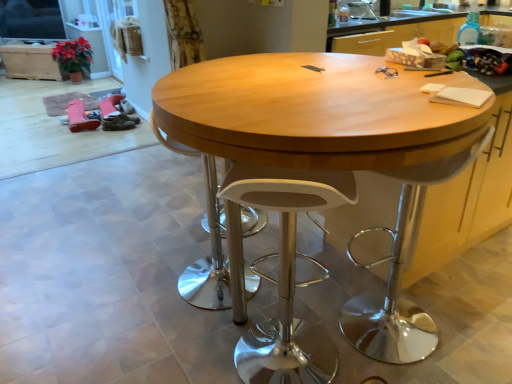
In order to face white plastic swivel chair at right, the first swivel chair in the right-to-left sequence, should I rotate leftwards or rightwards?

To align with it, rotate right about 19.222°.

Image resolution: width=512 pixels, height=384 pixels. Describe the element at coordinates (211, 240) in the screenshot. I see `white plastic swivel chair at center, the first swivel chair when ordered from left to right` at that location.

Measure the distance between point (323, 173) and camera.

Point (323, 173) and camera are 3.56 feet apart.

Identify the location of white plastic swivel chair at right, which is counted as the 2th swivel chair, starting from the left. (401, 272).

From a real-world perspective, who is located lower, white plastic swivel chair at center, the first swivel chair when ordered from left to right, or white plastic swivel chair at right, which is counted as the 2th swivel chair, starting from the left?

From a 3D spatial view, white plastic swivel chair at center, the first swivel chair when ordered from left to right, is below.

How different are the orientations of white plastic swivel chair at center, the first swivel chair when ordered from left to right, and white plastic swivel chair at right, which is counted as the 2th swivel chair, starting from the left, in degrees?

138 degrees separate the facing orientations of white plastic swivel chair at center, the first swivel chair when ordered from left to right, and white plastic swivel chair at right, which is counted as the 2th swivel chair, starting from the left.

Is white plastic swivel chair at center, the second swivel chair viewed from the right, inside the boundaries of white plastic swivel chair at right, the first swivel chair in the right-to-left sequence, or outside?

white plastic swivel chair at center, the second swivel chair viewed from the right, lies outside white plastic swivel chair at right, the first swivel chair in the right-to-left sequence.

Does white plastic swivel chair at center, the first swivel chair when ordered from left to right, have a larger size compared to white plastic swivel chair at right, which is counted as the 2th swivel chair, starting from the left?

Yes, white plastic swivel chair at center, the first swivel chair when ordered from left to right, is bigger than white plastic swivel chair at right, which is counted as the 2th swivel chair, starting from the left.

Where is `swivel chair on the right of the white plastic stool at center`? Image resolution: width=512 pixels, height=384 pixels. swivel chair on the right of the white plastic stool at center is located at coordinates (401, 272).

Between white plastic swivel chair at right, the first swivel chair in the right-to-left sequence, and white plastic stool at center, which one has less height?

Standing shorter between the two is white plastic stool at center.

Can you confirm if white plastic swivel chair at right, which is counted as the 2th swivel chair, starting from the left, is positioned to the left of white plastic stool at center?

In fact, white plastic swivel chair at right, which is counted as the 2th swivel chair, starting from the left, is to the right of white plastic stool at center.

Considering the positions of objects wooden cabinet at upper left and wooden table at center in the image provided, who is more to the right, wooden cabinet at upper left or wooden table at center?

wooden table at center.

Would you consider wooden cabinet at upper left to be distant from wooden table at center?

Yes, wooden cabinet at upper left is far from wooden table at center.

From the image's perspective, which is below, wooden cabinet at upper left or wooden table at center?

wooden table at center, from the image's perspective.

Does wooden cabinet at upper left contain wooden table at center?

That's incorrect, wooden table at center is not inside wooden cabinet at upper left.

Which is closer to the camera, (186, 270) or (232, 176)?

Point (186, 270) is farther from the camera than point (232, 176).

Which is more to the left, white plastic swivel chair at center, the second swivel chair viewed from the right, or white plastic stool at center?

Positioned to the left is white plastic swivel chair at center, the second swivel chair viewed from the right.

Considering the sizes of white plastic swivel chair at center, the second swivel chair viewed from the right, and white plastic stool at center in the image, is white plastic swivel chair at center, the second swivel chair viewed from the right, wider or thinner than white plastic stool at center?

In the image, white plastic swivel chair at center, the second swivel chair viewed from the right, appears to be wider than white plastic stool at center.

Based on their positions, is white plastic swivel chair at right, which is counted as the 2th swivel chair, starting from the left, located to the left or right of wooden table at center?

white plastic swivel chair at right, which is counted as the 2th swivel chair, starting from the left, is positioned on wooden table at center's right side.

Can you confirm if white plastic swivel chair at right, which is counted as the 2th swivel chair, starting from the left, is thinner than wooden table at center?

Yes.

Is white plastic swivel chair at right, the first swivel chair in the right-to-left sequence, positioned with its back to wooden table at center?

Absolutely, white plastic swivel chair at right, the first swivel chair in the right-to-left sequence, is directed away from wooden table at center.

From a real-world perspective, relative to white plastic stool at center, is wooden table at center vertically above or below?

wooden table at center is situated higher than white plastic stool at center in the real world.

Is wooden table at center to the left or to the right of white plastic stool at center in the image?

wooden table at center is to the right of white plastic stool at center.

Considering the sizes of wooden table at center and white plastic stool at center in the image, is wooden table at center wider or thinner than white plastic stool at center?

Considering their sizes, wooden table at center looks broader than white plastic stool at center.

From the picture: In terms of height, does wooden table at center look taller or shorter compared to white plastic stool at center?

Considering their sizes, wooden table at center has more height than white plastic stool at center.

Where is `table in front of the white plastic stool at center`? This screenshot has width=512, height=384. table in front of the white plastic stool at center is located at coordinates (315, 112).

Is white plastic stool at center turned away from wooden table at center?

Yes, white plastic stool at center is positioned with its back facing wooden table at center.

Is white plastic stool at center far away from wooden table at center?

No.

Find the location of `swivel chair that is behind the white plastic swivel chair at right, the first swivel chair in the right-to-left sequence`. swivel chair that is behind the white plastic swivel chair at right, the first swivel chair in the right-to-left sequence is located at coordinates (211, 240).

Locate an element on the screen. stool below the white plastic swivel chair at right, the first swivel chair in the right-to-left sequence (from the image's perspective) is located at coordinates (287, 273).

Consider the image. When comparing their distances from white plastic swivel chair at center, the second swivel chair viewed from the right, does white plastic swivel chair at right, the first swivel chair in the right-to-left sequence, or white plastic stool at center seem further?

white plastic swivel chair at right, the first swivel chair in the right-to-left sequence, is positioned further to the anchor white plastic swivel chair at center, the second swivel chair viewed from the right.

Which object lies further to the anchor point wooden table at center, white plastic swivel chair at right, which is counted as the 2th swivel chair, starting from the left, or wooden cabinet at upper left?

Among the two, wooden cabinet at upper left is located further to wooden table at center.

Which object lies further to the anchor point white plastic swivel chair at right, the first swivel chair in the right-to-left sequence, wooden table at center or white plastic stool at center?

Among the two, wooden table at center is located further to white plastic swivel chair at right, the first swivel chair in the right-to-left sequence.

Looking at the image, which one is located closer to wooden table at center, wooden cabinet at upper left or white plastic swivel chair at center, the first swivel chair when ordered from left to right?

Based on the image, white plastic swivel chair at center, the first swivel chair when ordered from left to right, appears to be nearer to wooden table at center.

Estimate the real-world distances between objects in this image. Which object is further from white plastic swivel chair at right, which is counted as the 2th swivel chair, starting from the left, wooden table at center or white plastic swivel chair at center, the first swivel chair when ordered from left to right?

Based on the image, white plastic swivel chair at center, the first swivel chair when ordered from left to right, appears to be further to white plastic swivel chair at right, which is counted as the 2th swivel chair, starting from the left.

Considering their positions, is white plastic swivel chair at center, the first swivel chair when ordered from left to right, positioned further to wooden table at center than white plastic stool at center?

white plastic swivel chair at center, the first swivel chair when ordered from left to right, lies further to wooden table at center than the other object.

Based on their spatial positions, is white plastic swivel chair at center, the first swivel chair when ordered from left to right, or wooden cabinet at upper left closer to white plastic swivel chair at right, the first swivel chair in the right-to-left sequence?

The object closer to white plastic swivel chair at right, the first swivel chair in the right-to-left sequence, is white plastic swivel chair at center, the first swivel chair when ordered from left to right.

Considering their positions, is wooden table at center positioned closer to white plastic stool at center than white plastic swivel chair at center, the first swivel chair when ordered from left to right?

white plastic swivel chair at center, the first swivel chair when ordered from left to right, lies closer to white plastic stool at center than the other object.

Locate an element on the screen. Image resolution: width=512 pixels, height=384 pixels. stool between wooden table at center and wooden cabinet at upper left from front to back is located at coordinates (287, 273).

Identify the location of table between white plastic swivel chair at center, the second swivel chair viewed from the right, and white plastic swivel chair at right, which is counted as the 2th swivel chair, starting from the left, from left to right. The width and height of the screenshot is (512, 384). (315, 112).

The width and height of the screenshot is (512, 384). Identify the location of swivel chair positioned between white plastic swivel chair at right, which is counted as the 2th swivel chair, starting from the left, and wooden cabinet at upper left from near to far. (211, 240).

Locate an element on the screen. The height and width of the screenshot is (384, 512). stool between wooden table at center and white plastic swivel chair at center, the first swivel chair when ordered from left to right, in the front-back direction is located at coordinates (x=287, y=273).